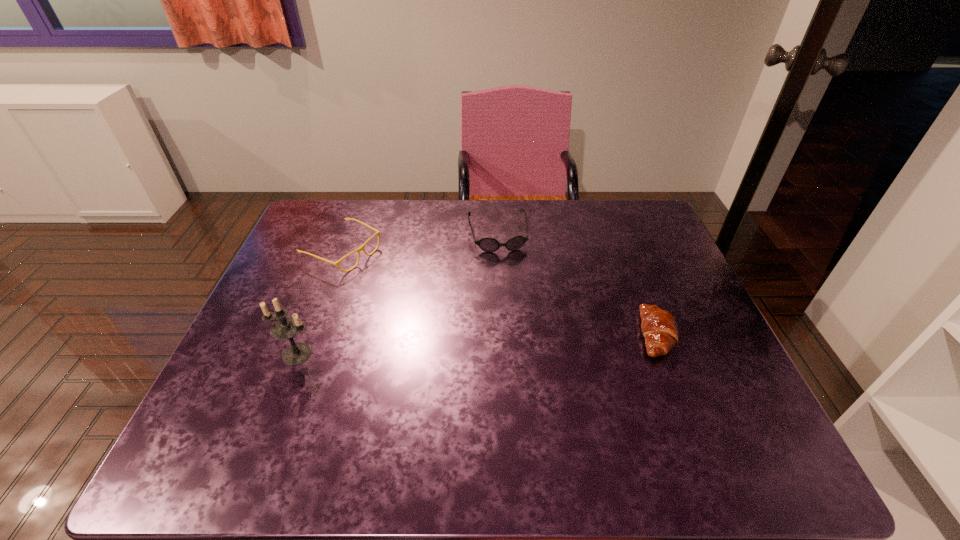
The width and height of the screenshot is (960, 540). What are the coordinates of `vacant region located in front of the lenses of the spectacles` in the screenshot? It's located at (430, 293).

Where is `blank space located in front of the lenses of the spectacles`? Image resolution: width=960 pixels, height=540 pixels. blank space located in front of the lenses of the spectacles is located at coordinates (455, 305).

I want to click on sunglasses that is at the far edge, so click(x=487, y=244).

The image size is (960, 540). What are the coordinates of `spectacles present at the far edge` in the screenshot? It's located at (360, 248).

Locate an element on the screen. candle holder present at the left edge is located at coordinates (286, 327).

Locate an element on the screen. This screenshot has height=540, width=960. spectacles that is at the left edge is located at coordinates (360, 248).

This screenshot has height=540, width=960. Identify the location of object at the right edge. (659, 328).

Find the location of a particular element. This screenshot has height=540, width=960. object located at the far left corner is located at coordinates (x=360, y=248).

This screenshot has height=540, width=960. I want to click on free space at the far edge of the desktop, so click(x=462, y=207).

Image resolution: width=960 pixels, height=540 pixels. I want to click on vacant area at the near edge of the desktop, so click(x=326, y=397).